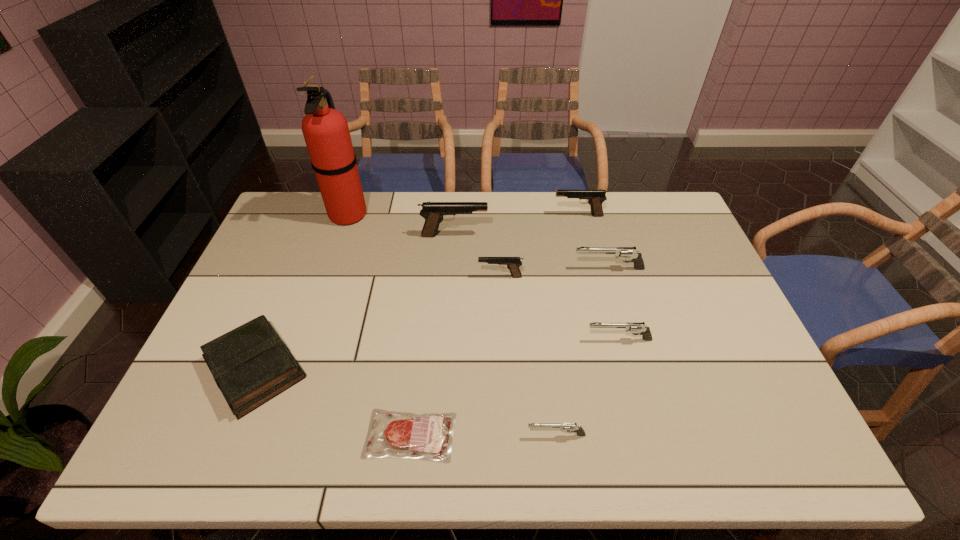
Identify the location of the tallest object. The width and height of the screenshot is (960, 540). (325, 130).

Find the location of a particular element. The image size is (960, 540). fire extinguisher is located at coordinates (325, 130).

Find the location of a particular element. This screenshot has height=540, width=960. the biggest black pistol is located at coordinates (434, 213).

Find the location of `the second tallest object`. the second tallest object is located at coordinates (434, 213).

Where is `the third tallest object`? the third tallest object is located at coordinates (595, 198).

Locate an element on the screen. the fifth shortest pistol is located at coordinates (595, 198).

Where is `the fourth nearest pistol`? The width and height of the screenshot is (960, 540). the fourth nearest pistol is located at coordinates (630, 253).

This screenshot has width=960, height=540. What are the coordinates of `the biggest silver pistol` in the screenshot? It's located at (630, 253).

Identify the location of the smallest black pistol. This screenshot has height=540, width=960. [512, 263].

Image resolution: width=960 pixels, height=540 pixels. I want to click on the nearest black pistol, so click(512, 263).